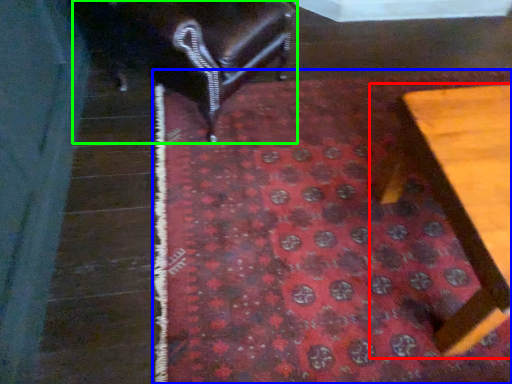
Question: Estimate the real-world distances between objects in this image. Which object is farther from furniture (highlighted by a red box), mat (highlighted by a blue box) or furniture (highlighted by a green box)?

Choices:
 (A) mat
 (B) furniture

Answer: (B)